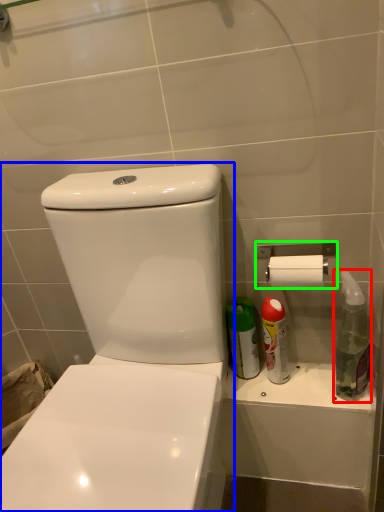
Question: Considering the real-world distances, which object is farthest from cleaning product (highlighted by a red box)? toilet (highlighted by a blue box) or towel bar (highlighted by a green box)?

Choices:
 (A) toilet
 (B) towel bar

Answer: (A)